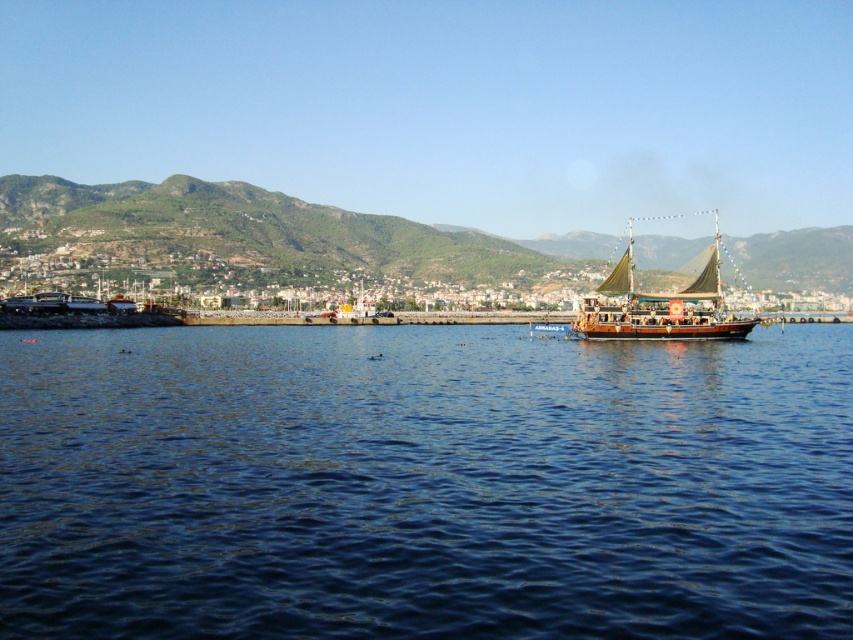
Can you confirm if blue water at center is taller than green textured mountain at upper center?

In fact, blue water at center may be shorter than green textured mountain at upper center.

Measure the distance between point (560, 406) and camera.

Point (560, 406) is 57.43 meters from camera.

Measure the distance between point (352, 474) and camera.

They are 136.35 feet apart.

I want to click on blue water at center, so click(x=422, y=483).

Who is more distant from viewer, (473, 241) or (665, 339)?

Positioned behind is point (473, 241).

Is green textured mountain at upper center smaller than wooden sailboat at right?

Actually, green textured mountain at upper center might be larger than wooden sailboat at right.

Is point (108, 188) positioned after point (650, 326)?

Yes, it is behind point (650, 326).

At what (x,y) coordinates should I click in order to perform the action: click on green textured mountain at upper center. Please return your answer as a coordinate pair (x, y). Looking at the image, I should click on (254, 234).

Between point (21, 506) and point (682, 321), which one is positioned behind?

Point (682, 321)

The image size is (853, 640). Describe the element at coordinates (422, 483) in the screenshot. I see `blue water at center` at that location.

Is point (241, 448) less distant than point (612, 323)?

Yes.

Where is `blue water at center`? blue water at center is located at coordinates (422, 483).